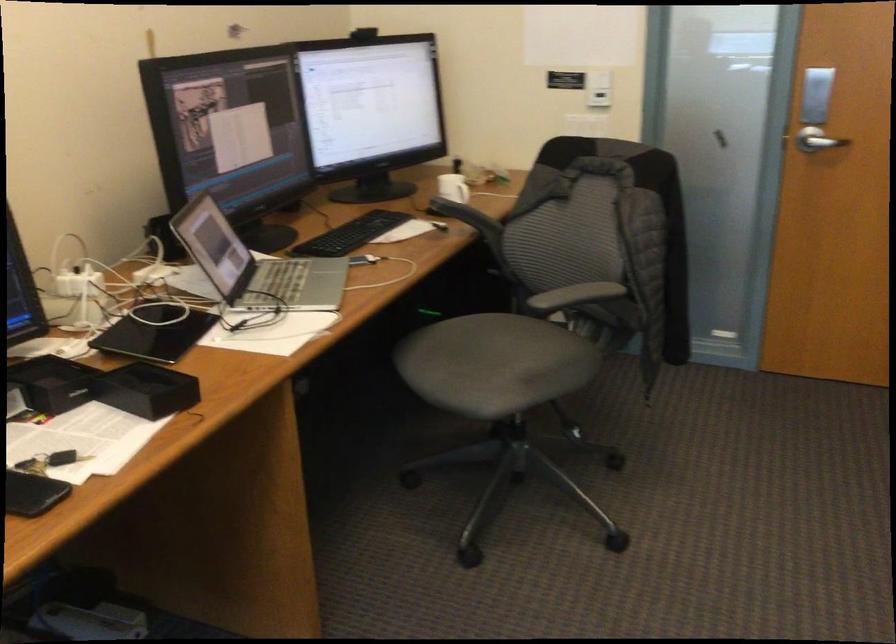
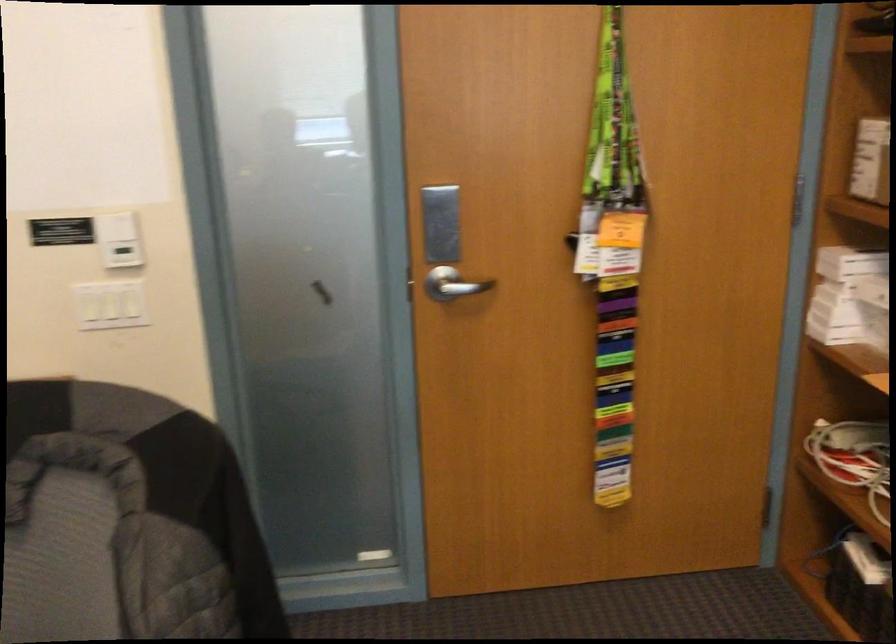
Locate, in the second image, the point that corresponds to the point at 607,69 in the first image.

(116, 225)